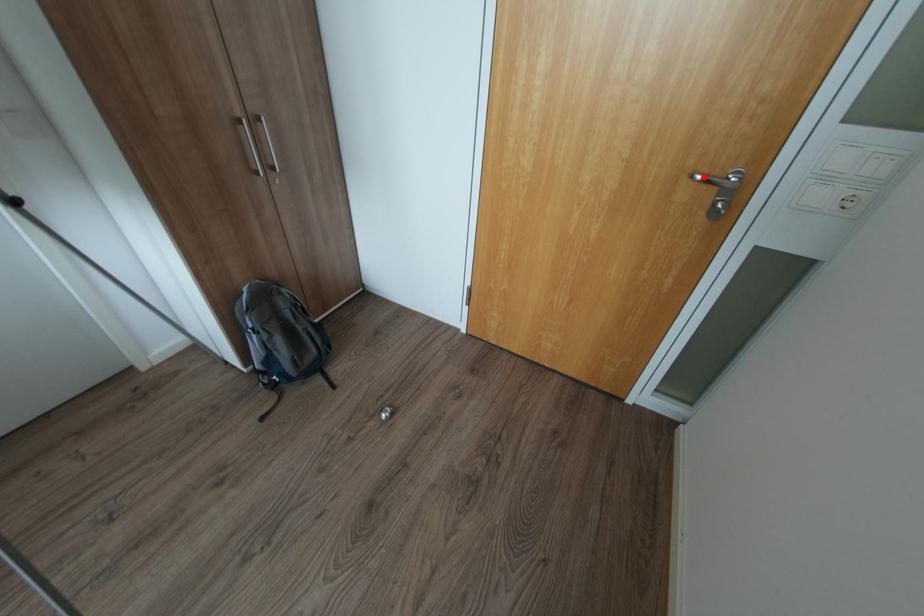
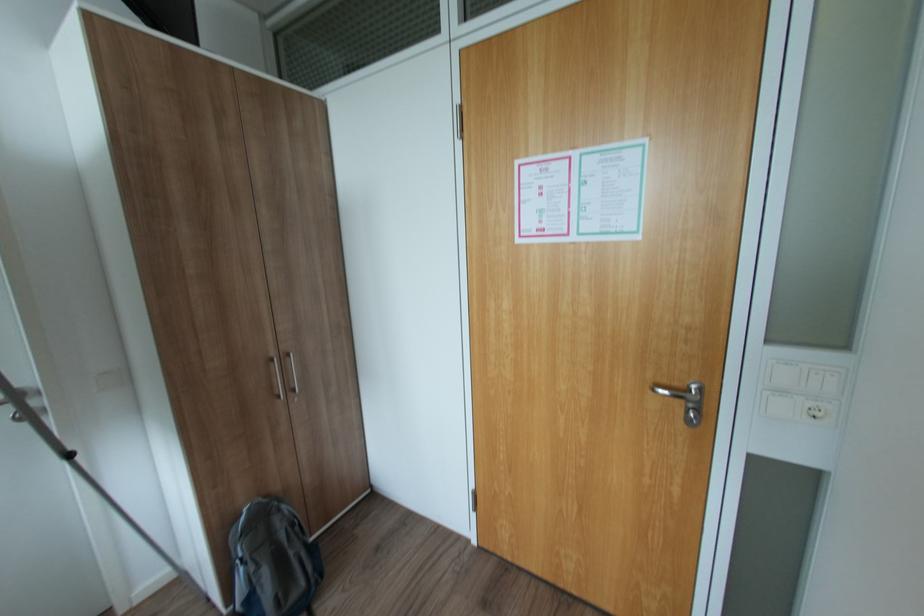
In the second image, find the point that corresponds to the highlighted location in the first image.

(664, 390)